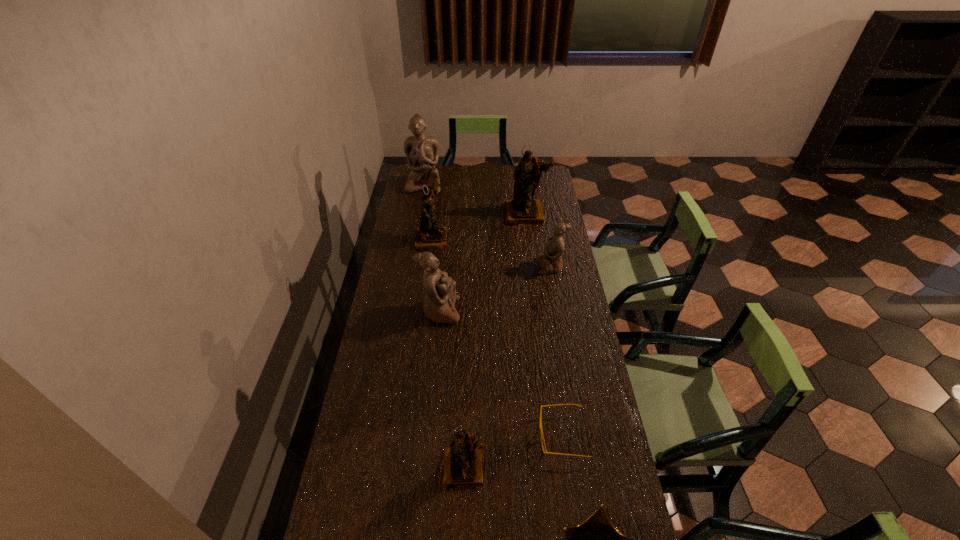
This screenshot has height=540, width=960. What are the coordinates of `the biggest white figurine` in the screenshot? It's located at (422, 152).

Where is `the farthest white figurine`? The height and width of the screenshot is (540, 960). the farthest white figurine is located at coordinates (422, 152).

Find the location of a particular element. The height and width of the screenshot is (540, 960). the biggest gold figurine is located at coordinates (523, 209).

Find the location of a particular element. This screenshot has height=540, width=960. the rightmost gold figurine is located at coordinates (523, 209).

What are the coordinates of `the sixth nearest object` in the screenshot? It's located at (429, 236).

I want to click on the leftmost gold figurine, so click(x=429, y=236).

Find the location of `the fifth farthest object`. the fifth farthest object is located at coordinates (440, 296).

Where is `the nearest white figurine`? This screenshot has height=540, width=960. the nearest white figurine is located at coordinates (440, 296).

Where is `the smallest white figurine`? the smallest white figurine is located at coordinates (551, 261).

This screenshot has width=960, height=540. What are the coordinates of `the fourth farthest object` in the screenshot? It's located at (551, 261).